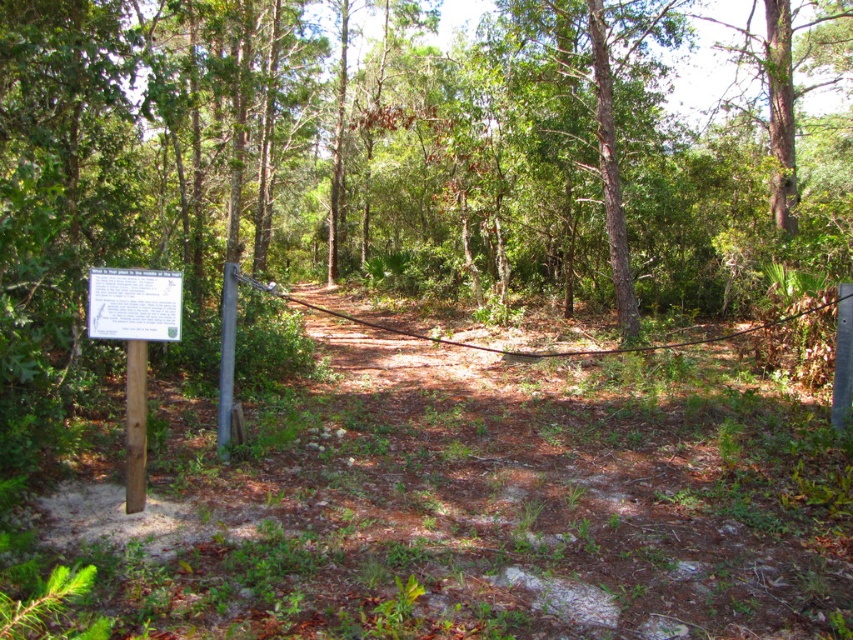
Measure the distance from brown dirt track at center to white paper sign at left.

A distance of 5.74 feet exists between brown dirt track at center and white paper sign at left.

Does brown dirt track at center appear on the left side of white paper sign at left?

In fact, brown dirt track at center is to the right of white paper sign at left.

Where is `brown dirt track at center`? The height and width of the screenshot is (640, 853). brown dirt track at center is located at coordinates (485, 506).